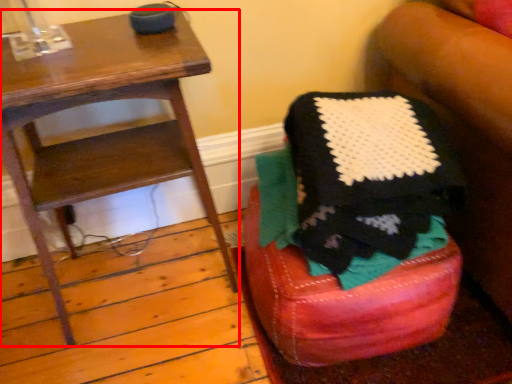
Question: From the image's perspective, what is the correct spatial positioning of furniture (annotated by the red box) in reference to bar stool?

Choices:
 (A) above
 (B) below

Answer: (A)